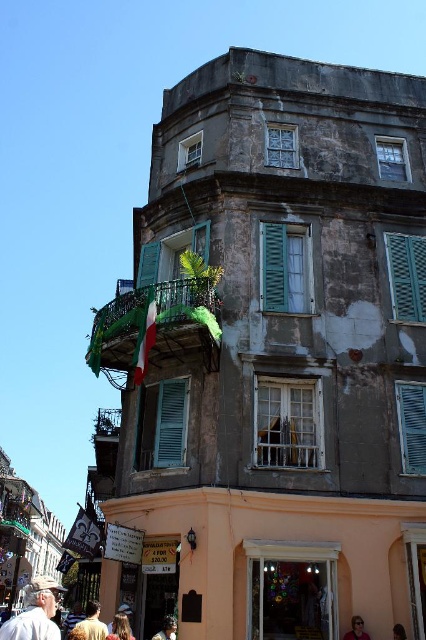
Question: Does green matte shutters at center appear on the left side of brown hair at lower right?

Choices:
 (A) yes
 (B) no

Answer: (A)

Question: Which point is farther from the camera taking this photo?

Choices:
 (A) click(91, 630)
 (B) click(20, 630)
 (C) click(396, 634)

Answer: (C)

Question: In this image, where is brown leather jacket at lower left located relative to blonde hair at lower center?

Choices:
 (A) below
 (B) above

Answer: (A)

Question: Considering the real-world distances, which object is farthest from the green painted wood at center?

Choices:
 (A) green matte shutters at center
 (B) green wrought iron balcony at upper center
 (C) white cotton shirt at lower left
 (D) blonde hair at lower center

Answer: (C)

Question: Which point is farther from the camera taking this photo?

Choices:
 (A) (423, 445)
 (B) (422, 300)
 (C) (299, 301)
 (D) (31, 589)

Answer: (B)

Question: Can you confirm if blonde hair at lower center is bigger than brown hair at lower right?

Choices:
 (A) yes
 (B) no

Answer: (A)